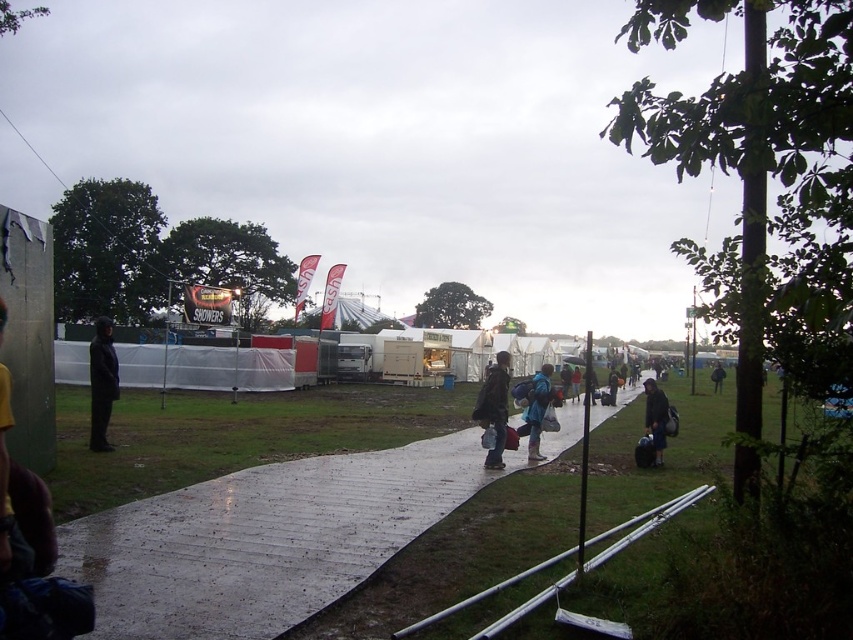
Question: Is the position of dark brown leather jacket at center more distant than that of dark blue jacket at center?

Choices:
 (A) yes
 (B) no

Answer: (B)

Question: Among these points, which one is farthest from the camera?

Choices:
 (A) click(x=660, y=419)
 (B) click(x=496, y=452)
 (C) click(x=616, y=372)
 (D) click(x=576, y=420)

Answer: (C)

Question: Which point is farther to the camera?

Choices:
 (A) blue fabric jacket at center
 (B) dark blue jacket at center
 (C) dark gray fabric jacket at left
 (D) black fabric bag at center-right

Answer: (D)

Question: Does wet plastic walkway at center have a larger size compared to dark gray fabric jacket at left?

Choices:
 (A) no
 (B) yes

Answer: (A)

Question: Estimate the real-world distances between objects in this image. Which object is closer to the dark gray fabric jacket at left?

Choices:
 (A) blue fabric jacket at center
 (B) dark brown leather jacket at center
 (C) dark blue fabric bag at lower right

Answer: (B)

Question: Can you confirm if dark gray fabric jacket at left is thinner than dark brown leather jacket at center?

Choices:
 (A) no
 (B) yes

Answer: (A)